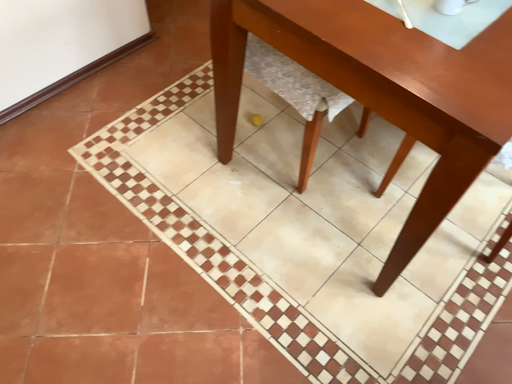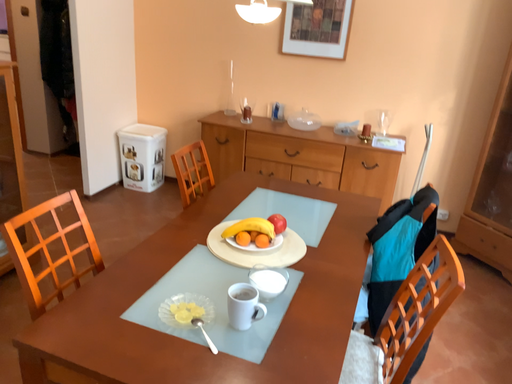
Question: How did the camera likely rotate when shooting the video?

Choices:
 (A) rotated right
 (B) rotated left

Answer: (A)